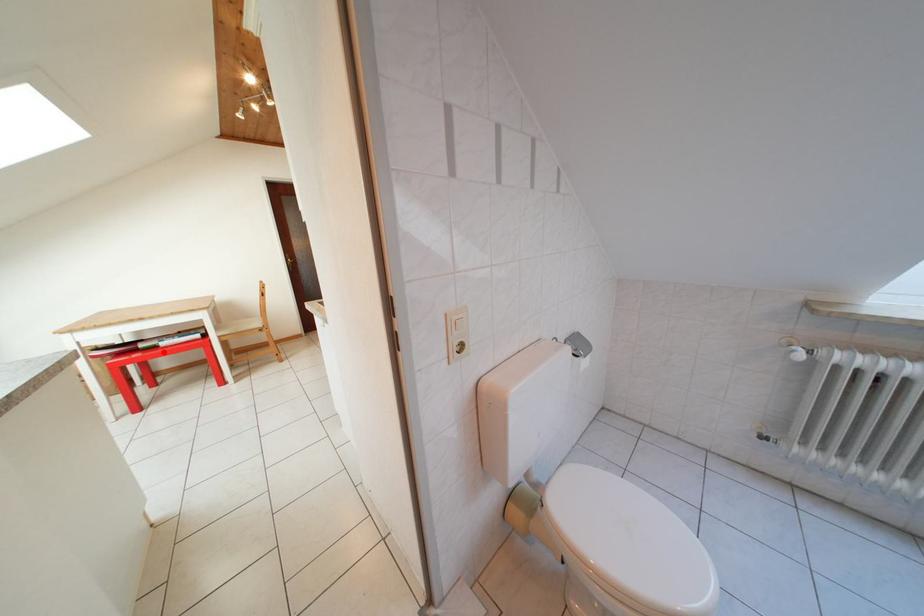
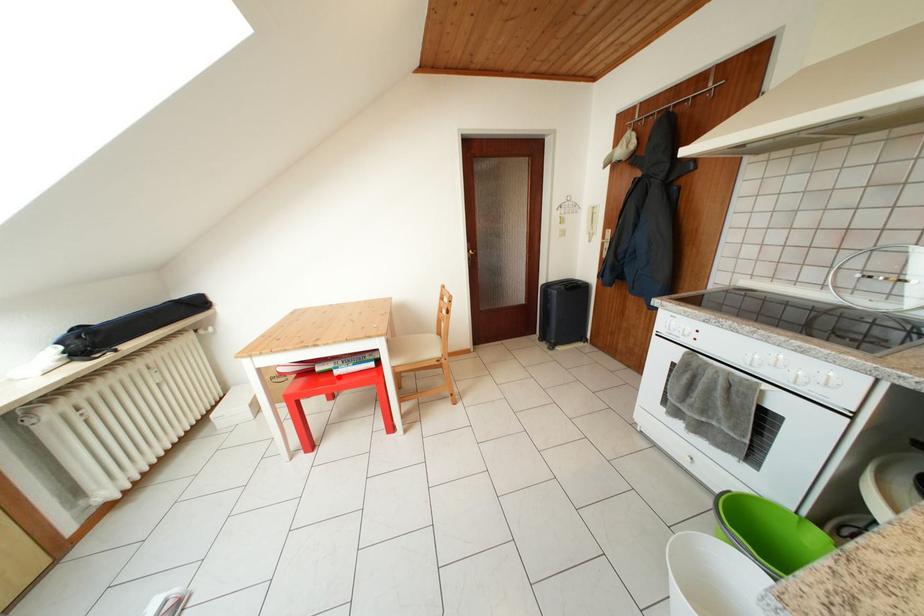
I am providing you with two images of the same scene from different viewpoints. A red point is marked on the first image and another point is marked on the second image. Does the point marked in image1 correspond to the same location as the one in image2?

Yes